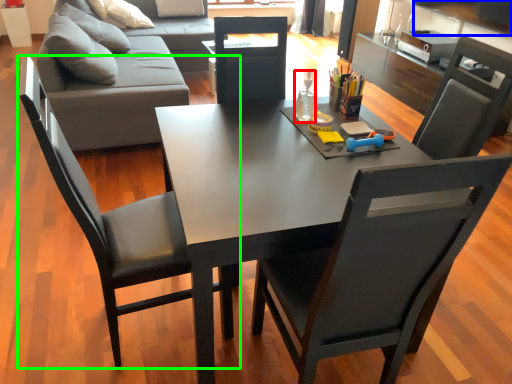
Question: Based on their relative distances, which object is nearer to bottle (highlighted by a red box)? Choose from television (highlighted by a blue box) and chair (highlighted by a green box).

Choices:
 (A) television
 (B) chair

Answer: (B)